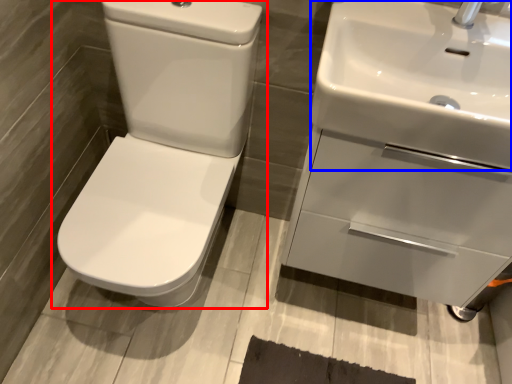
Question: Which point is closer to the camera, toilet (highlighted by a red box) or sink (highlighted by a blue box)?

Choices:
 (A) toilet
 (B) sink

Answer: (B)